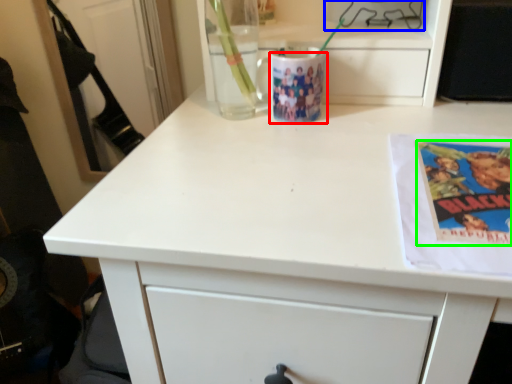
Question: Estimate the real-world distances between objects in this image. Which object is farther from mug (highlighted by a red box), appliance (highlighted by a blue box) or paperback book (highlighted by a green box)?

Choices:
 (A) appliance
 (B) paperback book

Answer: (B)